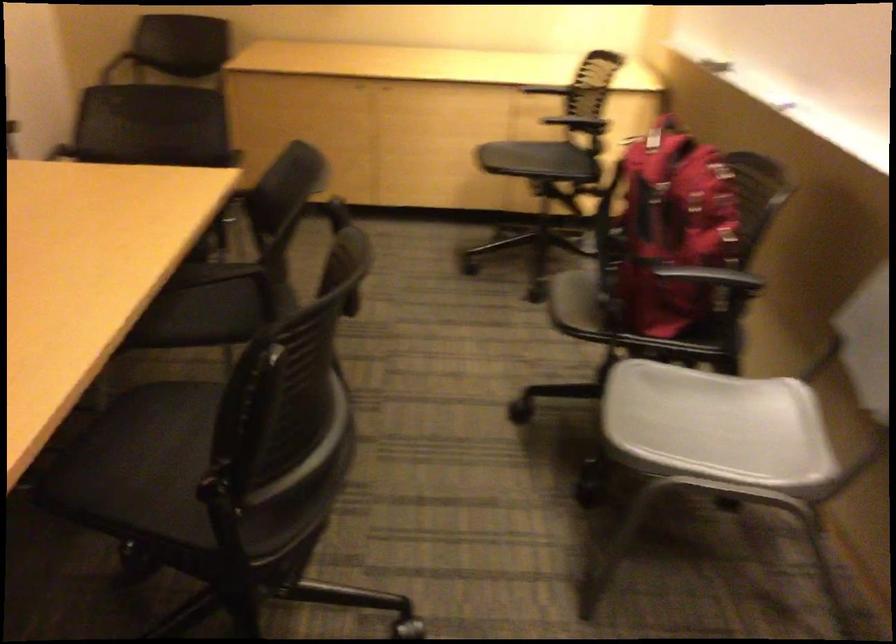
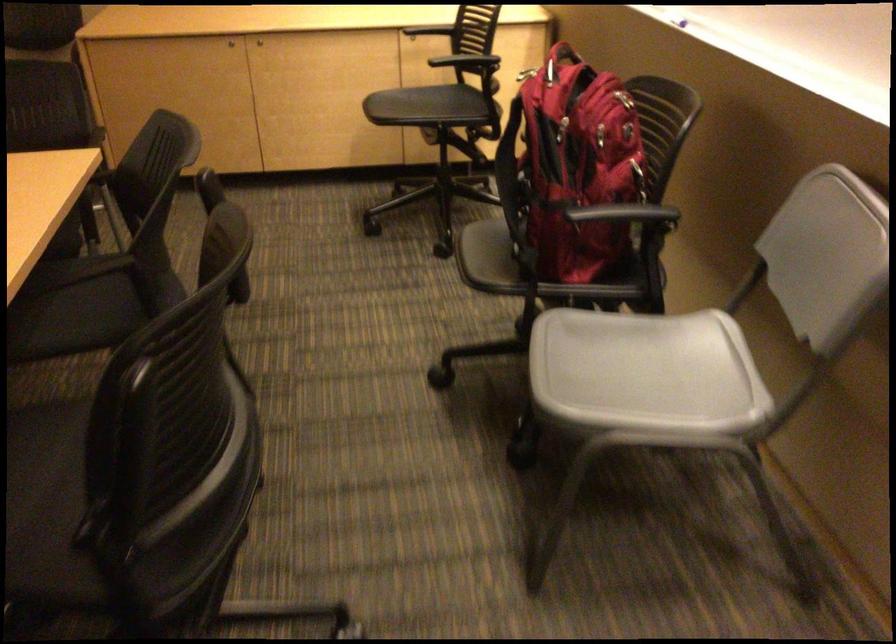
Locate, in the second image, the point that corresponds to [666,187] in the first image.

(564, 127)